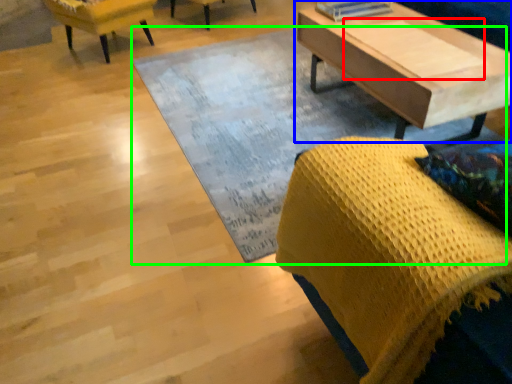
Question: Estimate the real-world distances between objects in this image. Which object is closer to plank (highlighted by a red box), coffee table (highlighted by a blue box) or mat (highlighted by a green box)?

Choices:
 (A) coffee table
 (B) mat

Answer: (A)